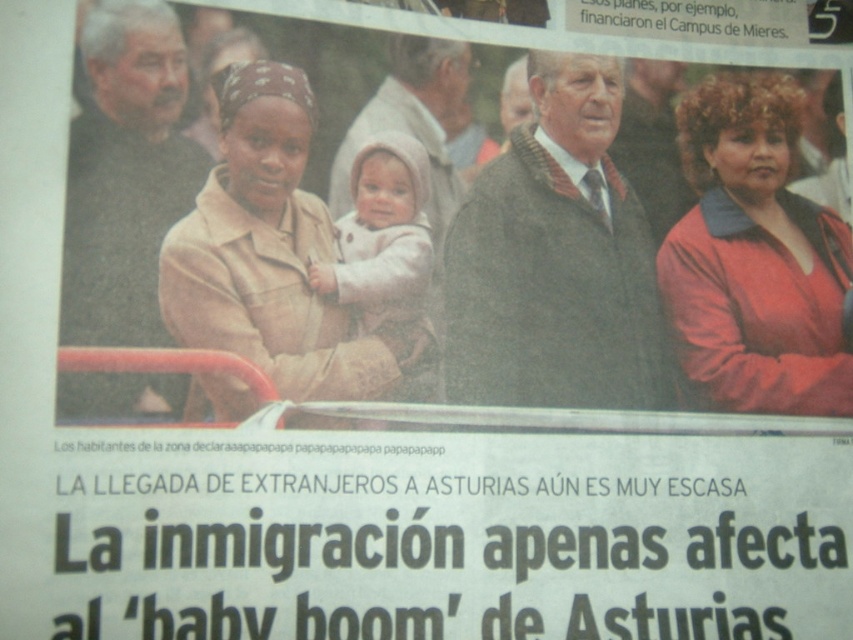
Between matte red sweater at right and beige fabric jacket at center, which one is positioned higher?

Positioned higher is beige fabric jacket at center.

Who is taller, matte red sweater at right or beige fabric jacket at center?

With more height is matte red sweater at right.

Describe the element at coordinates (755, 259) in the screenshot. Image resolution: width=853 pixels, height=640 pixels. I see `matte red sweater at right` at that location.

You are a GUI agent. You are given a task and a screenshot of the screen. Output one action in this format:
    pyautogui.click(x=<x>, y=<y>)
    Task: Click on the matte red sweater at right
    Image resolution: width=853 pixels, height=640 pixels.
    Given the screenshot: What is the action you would take?
    pyautogui.click(x=755, y=259)

Does matte red sweater at right have a lesser height compared to light beige fabric baby at center?

No, matte red sweater at right is not shorter than light beige fabric baby at center.

Measure the distance between matte red sweater at right and light beige fabric baby at center.

matte red sweater at right and light beige fabric baby at center are 21.51 inches apart.

The height and width of the screenshot is (640, 853). What do you see at coordinates (755, 259) in the screenshot?
I see `matte red sweater at right` at bounding box center [755, 259].

The height and width of the screenshot is (640, 853). I want to click on matte red sweater at right, so click(755, 259).

Who is lower down, beige fabric jacket at center or light beige fabric baby at center?

light beige fabric baby at center

Is beige fabric jacket at center wider than light beige fabric baby at center?

Yes.

Where is `beige fabric jacket at center`? The width and height of the screenshot is (853, 640). beige fabric jacket at center is located at coordinates (273, 256).